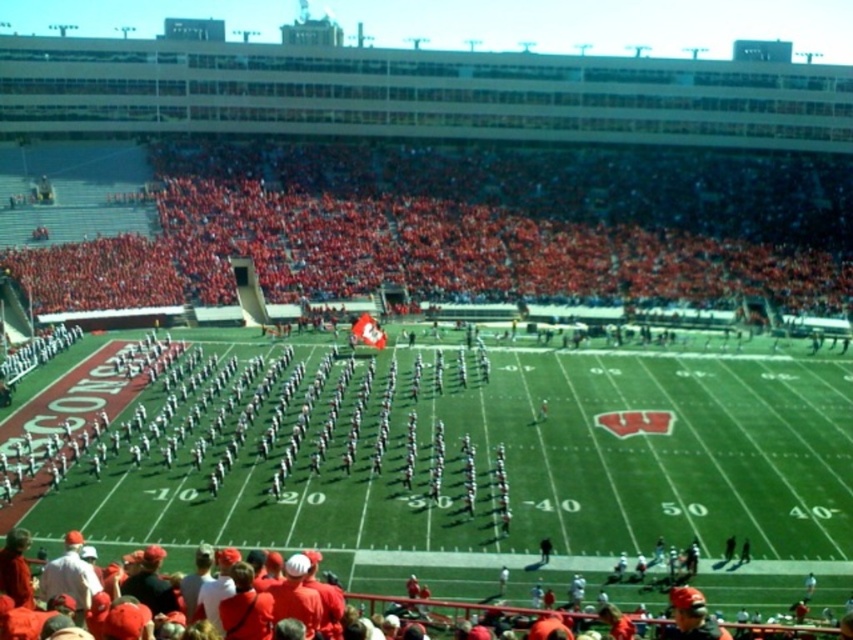
Question: Is red fabric seats at upper center bigger than white uniformed band at center?

Choices:
 (A) no
 (B) yes

Answer: (B)

Question: Which point is farther from the camera taking this photo?

Choices:
 (A) (436, 253)
 (B) (358, 460)

Answer: (A)

Question: Does red fabric seats at upper center appear on the right side of white uniformed band at center?

Choices:
 (A) yes
 (B) no

Answer: (A)

Question: Among these points, which one is farthest from the camera?

Choices:
 (A) (680, 292)
 (B) (341, 445)

Answer: (A)

Question: Which point is farther to the camera?

Choices:
 (A) (419, 493)
 (B) (572, 202)

Answer: (B)

Question: Does red fabric seats at upper center have a smaller size compared to white uniformed band at center?

Choices:
 (A) yes
 (B) no

Answer: (B)